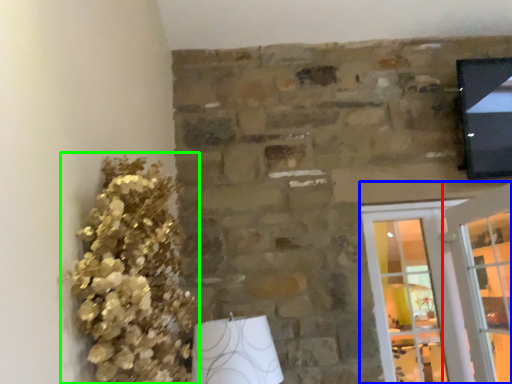
Question: Which is farther away from glass door (highlighted by a red box)? screen door (highlighted by a blue box) or floral arrangement (highlighted by a green box)?

Choices:
 (A) screen door
 (B) floral arrangement

Answer: (B)